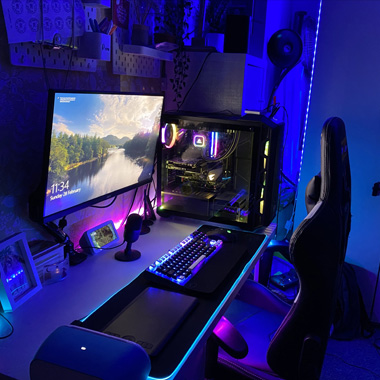
I want to click on left chair arm, so click(x=226, y=331).